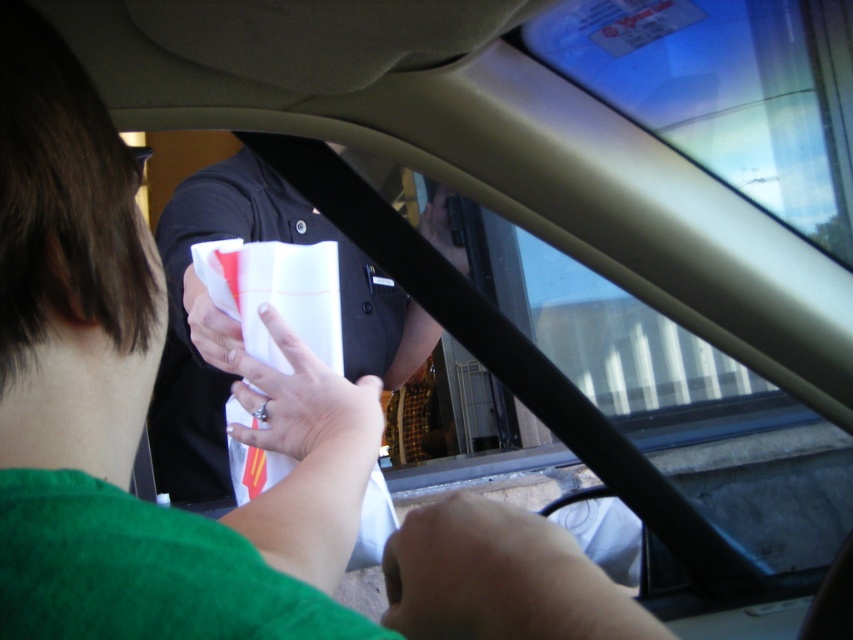
You are a passenger in the car and need to hand over the payment device to the person outside. The device is at point (500, 579). Where should you reach to give it to them?

The point (500, 579) is on the smooth skin hand at lower center, so you should reach towards your lower center to hand over the payment device.

You are a passenger in a car at a drive through. You see a smooth skin hand at lower center and a white paper at center. Which object is located below the other?

The smooth skin hand at lower center is positioned under the white paper at center.

You are a passenger in the car and need to reach for the smooth skin hand at lower center and the black plastic phone at upper center. Which object is closer to you?

The smooth skin hand at lower center is closer to you since it is shorter than the black plastic phone at upper center.